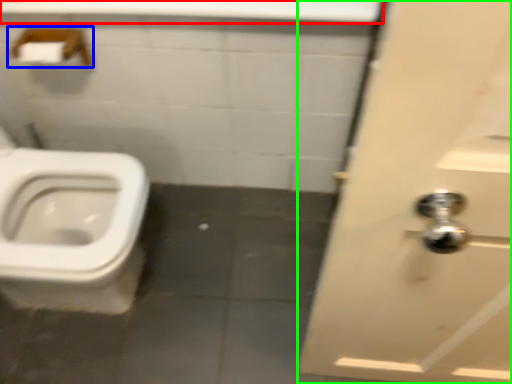
Question: Based on their relative distances, which object is farther from counter top (highlighted by a red box)? Choose from towel bar (highlighted by a blue box) and door (highlighted by a green box).

Choices:
 (A) towel bar
 (B) door

Answer: (B)